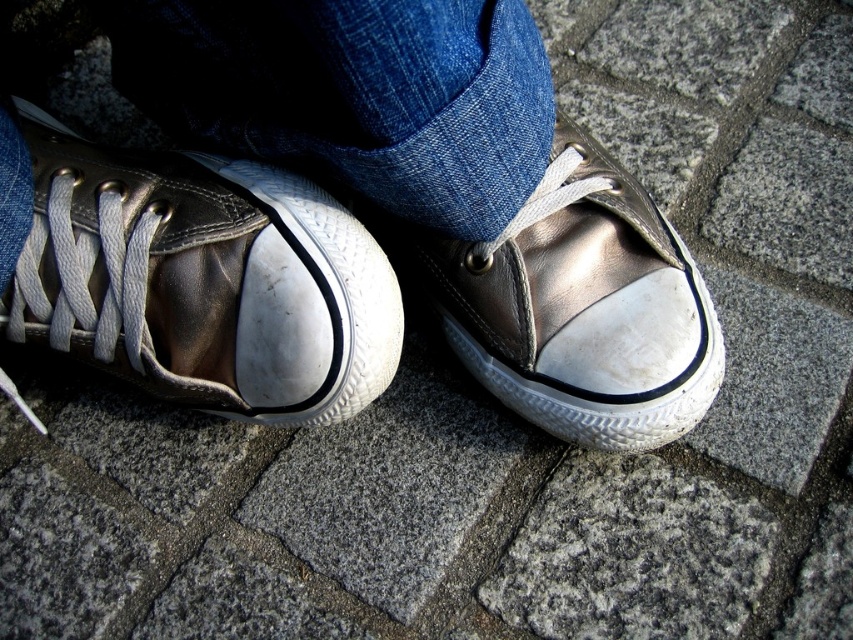
Question: Is metallic leather sneaker at center smaller than denim at center?

Choices:
 (A) yes
 (B) no

Answer: (A)

Question: Estimate the real-world distances between objects in this image. Which object is closer to the metallic leather shoe at center?

Choices:
 (A) metallic leather sneaker at center
 (B) denim at center

Answer: (B)

Question: Estimate the real-world distances between objects in this image. Which object is farther from the metallic leather shoe at center?

Choices:
 (A) metallic leather sneaker at center
 (B) denim at center

Answer: (A)

Question: Is metallic leather sneaker at center to the left of metallic leather shoe at center from the viewer's perspective?

Choices:
 (A) no
 (B) yes

Answer: (B)

Question: Considering the real-world distances, which object is farthest from the metallic leather sneaker at center?

Choices:
 (A) denim at center
 (B) metallic leather shoe at center

Answer: (B)

Question: Is metallic leather sneaker at center above denim at center?

Choices:
 (A) no
 (B) yes

Answer: (A)